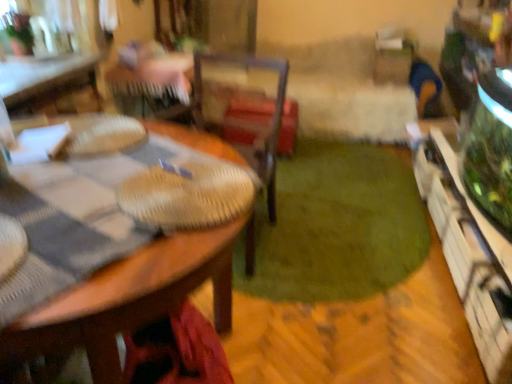
Question: Is green plush carpet at center looking in the opposite direction of wooden table at upper left, the 2th table when ordered from bottom to top?

Choices:
 (A) yes
 (B) no

Answer: (B)

Question: Is green plush carpet at center further to the viewer compared to wooden table at upper left, the 2th table when ordered from bottom to top?

Choices:
 (A) yes
 (B) no

Answer: (B)

Question: From the image's perspective, is green plush carpet at center on top of wooden table at upper left, which is counted as the 2th table, starting from the front?

Choices:
 (A) no
 (B) yes

Answer: (A)

Question: Can you confirm if green plush carpet at center is bigger than wooden table at upper left, placed as the first table when sorted from top to bottom?

Choices:
 (A) no
 (B) yes

Answer: (B)

Question: Is green plush carpet at center thinner than wooden table at upper left, placed as the first table when sorted from top to bottom?

Choices:
 (A) yes
 (B) no

Answer: (B)

Question: From the image's perspective, relative to green plush carpet at center, is wooden table at center, which is counted as the 2th table, starting from the top, above or below?

Choices:
 (A) above
 (B) below

Answer: (B)

Question: From a real-world perspective, is wooden table at center, placed as the 2th table when sorted from back to front, physically located above or below green plush carpet at center?

Choices:
 (A) below
 (B) above

Answer: (B)

Question: Is wooden table at center, the 1th table positioned from the bottom, wider or thinner than green plush carpet at center?

Choices:
 (A) wide
 (B) thin

Answer: (B)

Question: Considering their positions, is wooden table at center, which is the 1th table from front to back, located in front of or behind green plush carpet at center?

Choices:
 (A) behind
 (B) front

Answer: (B)

Question: Is green plush carpet at center taller or shorter than wooden table at center, which is counted as the 2th table, starting from the top?

Choices:
 (A) tall
 (B) short

Answer: (B)

Question: In terms of size, does green plush carpet at center appear bigger or smaller than wooden table at center, which is the 1th table from front to back?

Choices:
 (A) small
 (B) big

Answer: (A)

Question: Which is correct: green plush carpet at center is inside wooden table at center, the 1th table positioned from the bottom, or outside of it?

Choices:
 (A) inside
 (B) outside

Answer: (B)

Question: From the image's perspective, is green plush carpet at center positioned above or below wooden table at center, which is the 1th table from front to back?

Choices:
 (A) above
 (B) below

Answer: (A)

Question: From a real-world perspective, is woven wood chair at center physically located above or below green plush carpet at center?

Choices:
 (A) above
 (B) below

Answer: (A)

Question: From the image's perspective, relative to green plush carpet at center, is woven wood chair at center above or below?

Choices:
 (A) above
 (B) below

Answer: (A)